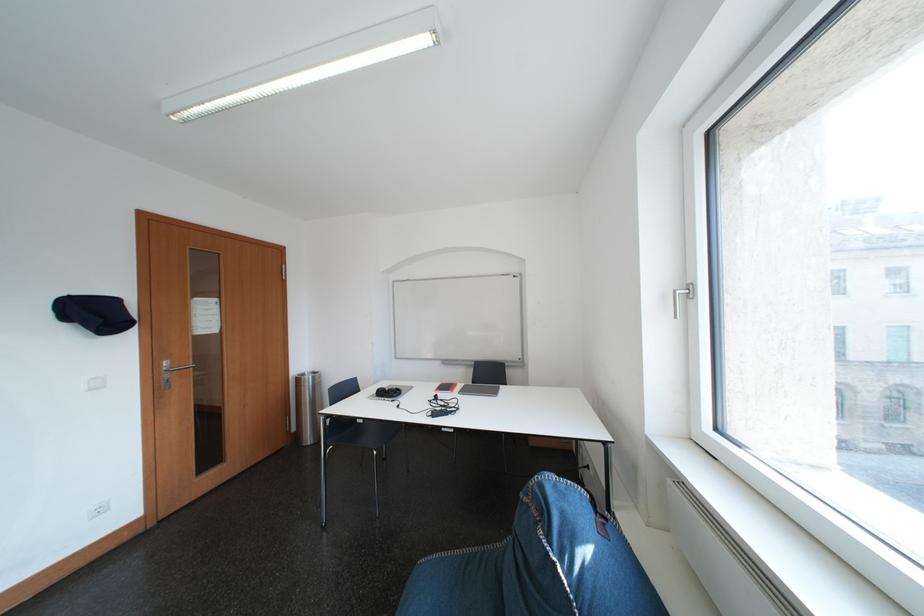
Where would you pull the silver door handle? Please return your answer as a coordinate pair (x, y).

(167, 381)